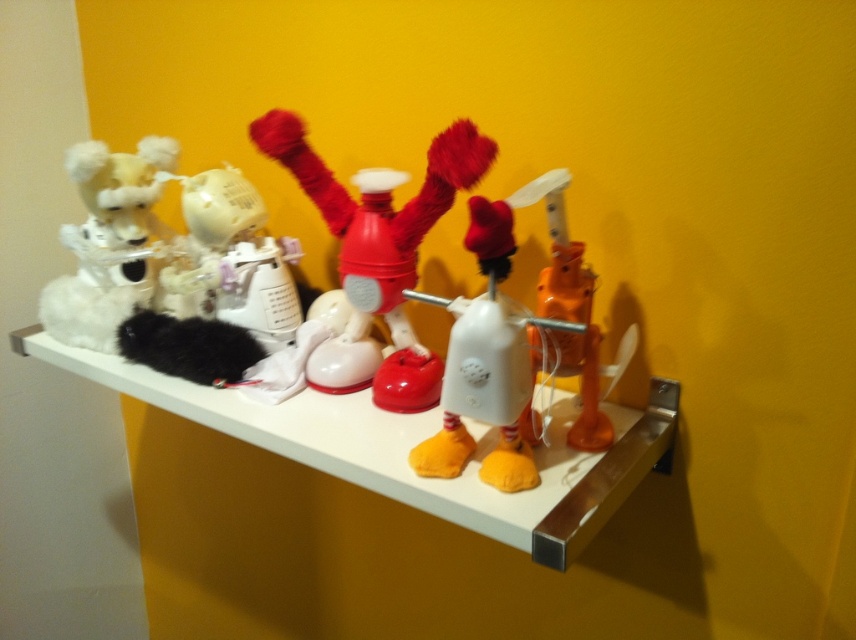
You are standing in front of a shelf with two points marked. The first point is at coordinates point (544, 557) and the second is at point (242, 339). Which point is closer to you?

Point (544, 557) is closer to the viewer than point (242, 339).

Where is the white plastic shelf at center located in the image?

The white plastic shelf at center is located at point 0.698 in the x coordinate and 0.481 in the y coordinate.

You are a small robot with a height of 12 inches. You need to reach an object placed on the white plastic shelf at center. Can you reach it based on your height?

The white plastic shelf at center is 22.66 inches away from the camera. Since the robot is only 12 inches tall, it cannot reach the shelf as the distance exceeds its height.